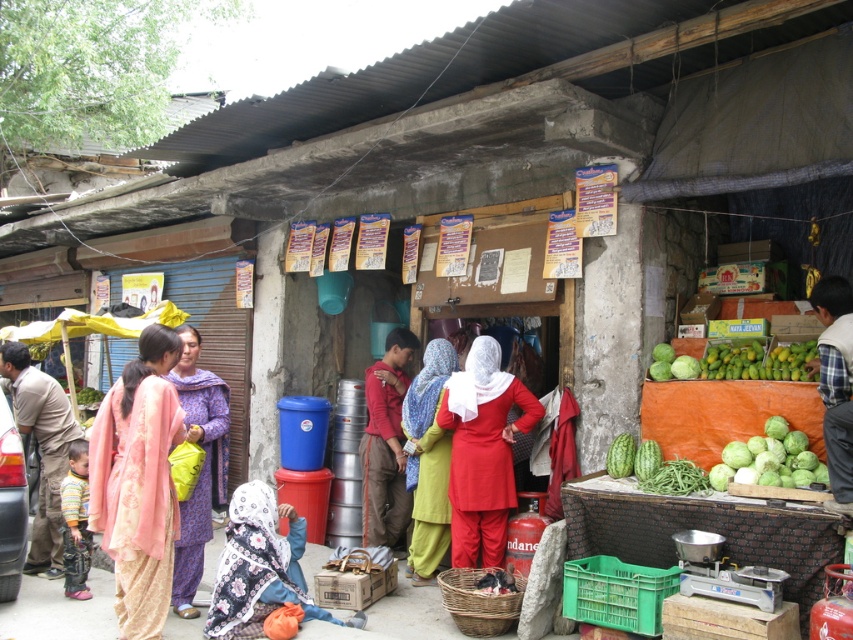
Does purple fabric dress at center appear on the left side of light green fabric at center?

Indeed, purple fabric dress at center is positioned on the left side of light green fabric at center.

Describe the element at coordinates (201, 467) in the screenshot. I see `purple fabric dress at center` at that location.

Is point (173, 376) positioned after point (438, 554)?

No, it is in front of (438, 554).

Image resolution: width=853 pixels, height=640 pixels. In order to click on purple fabric dress at center in this screenshot , I will do `click(201, 467)`.

Does light green fabric at center have a lesser width compared to green matte cabbage at lower right?

→ Indeed, light green fabric at center has a lesser width compared to green matte cabbage at lower right.

Does light green fabric at center appear over green matte cabbage at lower right?

Incorrect, light green fabric at center is not positioned above green matte cabbage at lower right.

Which is in front, point (418, 556) or point (758, 467)?

Point (758, 467) is more forward.

Locate an element on the screen. light green fabric at center is located at coordinates (427, 460).

Which is in front, point (167, 396) or point (619, 460)?

Point (167, 396) is more forward.

Is light pink silk saree at center to the left of green matte watermelon at lower right from the viewer's perspective?

Indeed, light pink silk saree at center is positioned on the left side of green matte watermelon at lower right.

Which is behind, point (90, 448) or point (630, 474)?

The point (630, 474) is behind.

Locate an element on the screen. The width and height of the screenshot is (853, 640). light pink silk saree at center is located at coordinates (138, 483).